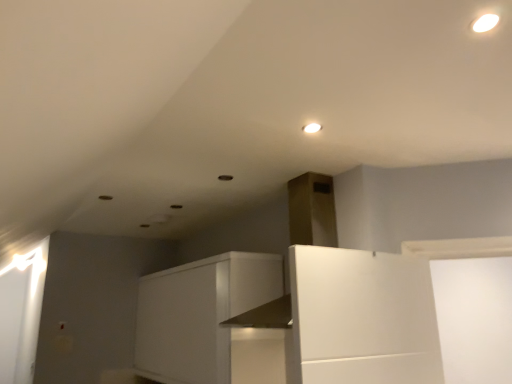
Question: Is white matte cabinet at center directly adjacent to matte white light fixture at upper center?

Choices:
 (A) no
 (B) yes

Answer: (A)

Question: Can you confirm if white matte cabinet at center is thinner than matte white light fixture at upper center?

Choices:
 (A) yes
 (B) no

Answer: (B)

Question: From a real-world perspective, is white matte cabinet at center physically above matte white light fixture at upper center?

Choices:
 (A) yes
 (B) no

Answer: (B)

Question: Considering the relative sizes of white matte cabinet at center and matte white light fixture at upper center in the image provided, is white matte cabinet at center taller than matte white light fixture at upper center?

Choices:
 (A) yes
 (B) no

Answer: (A)

Question: Would you consider white matte cabinet at center to be distant from matte white light fixture at upper center?

Choices:
 (A) no
 (B) yes

Answer: (B)

Question: Is white matte cabinet at center outside matte white light fixture at upper center?

Choices:
 (A) yes
 (B) no

Answer: (A)

Question: Is matte white light fixture at upper center to the right of white matte cabinet at center from the viewer's perspective?

Choices:
 (A) no
 (B) yes

Answer: (B)

Question: Is matte white light fixture at upper center oriented away from white matte cabinet at center?

Choices:
 (A) yes
 (B) no

Answer: (B)

Question: Is white matte cabinet at center inside matte white light fixture at upper center?

Choices:
 (A) yes
 (B) no

Answer: (B)

Question: From the image's perspective, is matte white light fixture at upper center over white matte cabinet at center?

Choices:
 (A) yes
 (B) no

Answer: (A)

Question: From a real-world perspective, does matte white light fixture at upper center sit lower than white matte cabinet at center?

Choices:
 (A) no
 (B) yes

Answer: (A)

Question: Can you confirm if matte white light fixture at upper center is thinner than white matte cabinet at center?

Choices:
 (A) no
 (B) yes

Answer: (B)

Question: From the image's perspective, is white matte cabinet at center located above or below matte white light fixture at upper center?

Choices:
 (A) above
 (B) below

Answer: (B)